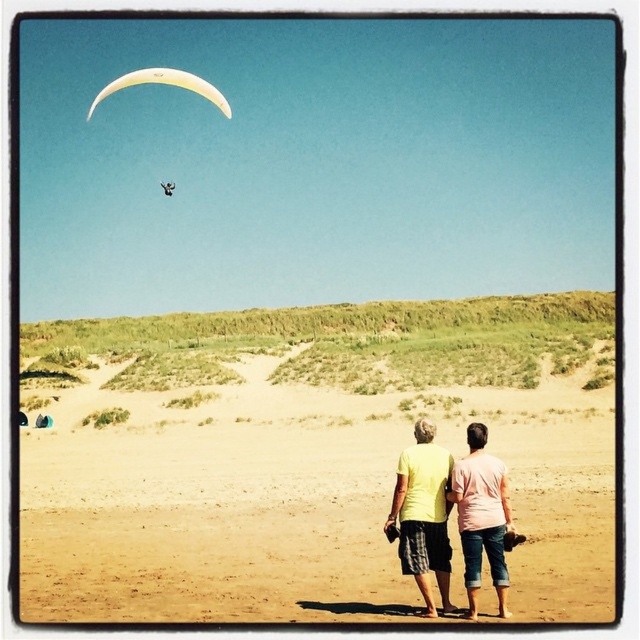
Is sandy yellow beach at center positioned at the back of yellow matte shirt at center?

No, it is not.

Can you confirm if sandy yellow beach at center is shorter than yellow matte shirt at center?

In fact, sandy yellow beach at center may be taller than yellow matte shirt at center.

You are a GUI agent. You are given a task and a screenshot of the screen. Output one action in this format:
    pyautogui.click(x=<x>, y=<y>)
    Task: Click on the sandy yellow beach at center
    This screenshot has height=640, width=640.
    Given the screenshot: What is the action you would take?
    pyautogui.click(x=305, y=454)

Which is above, sandy yellow beach at center or yellow fabric parachute at upper center?

yellow fabric parachute at upper center is above.

Who is positioned more to the left, sandy yellow beach at center or yellow fabric parachute at upper center?

yellow fabric parachute at upper center is more to the left.

Identify the location of sandy yellow beach at center. (305, 454).

Locate an element on the screen. sandy yellow beach at center is located at coordinates (305, 454).

Does yellow matte shirt at center appear on the right side of yellow fabric parachute at upper center?

Indeed, yellow matte shirt at center is positioned on the right side of yellow fabric parachute at upper center.

Which is more to the right, yellow matte shirt at center or yellow fabric parachute at upper center?

yellow matte shirt at center is more to the right.

The width and height of the screenshot is (640, 640). What do you see at coordinates (481, 515) in the screenshot?
I see `yellow matte shirt at center` at bounding box center [481, 515].

At what (x,y) coordinates should I click in order to perform the action: click on yellow matte shirt at center. Please return your answer as a coordinate pair (x, y). The height and width of the screenshot is (640, 640). Looking at the image, I should click on (481, 515).